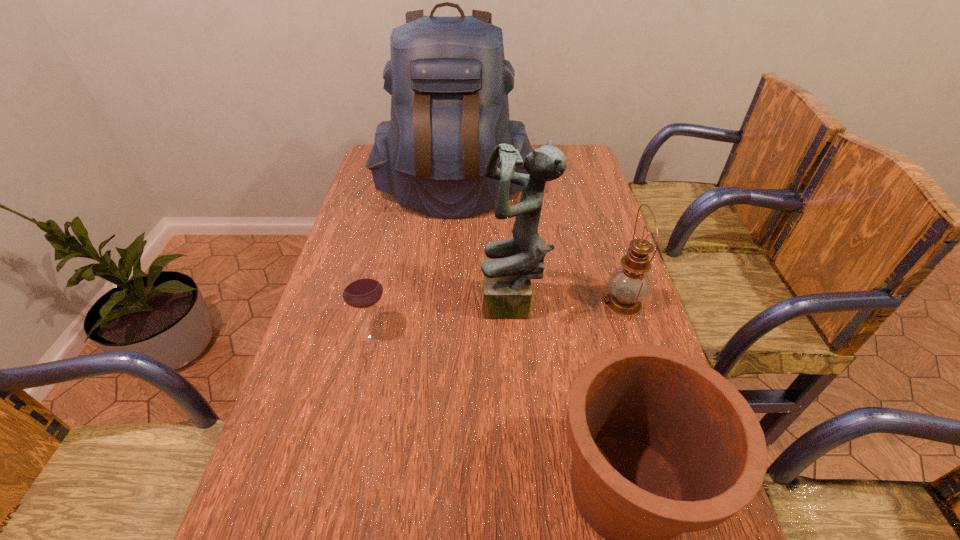
Locate an element on the screen. vacant space situated on the right of the shortest object is located at coordinates (500, 328).

Identify the location of object located at the far edge. This screenshot has height=540, width=960. (448, 79).

Identify the location of backpack that is at the left edge. (448, 79).

Locate an element on the screen. wineglass at the left edge is located at coordinates (361, 289).

Locate an element on the screen. object that is positioned at the right edge is located at coordinates (629, 284).

Find the location of a particular element. object situated at the far left corner is located at coordinates (448, 79).

Image resolution: width=960 pixels, height=540 pixels. What are the coordinates of `free location at the left edge` in the screenshot? It's located at (328, 353).

This screenshot has width=960, height=540. I want to click on free space at the right edge, so click(621, 329).

At what (x,y) coordinates should I click in order to perform the action: click on vacant space in between the sculpture and the farthest object. Please return your answer as a coordinate pair (x, y). Looking at the image, I should click on (483, 249).

This screenshot has height=540, width=960. Identify the location of free space between the backpack and the second tallest object. (x=483, y=249).